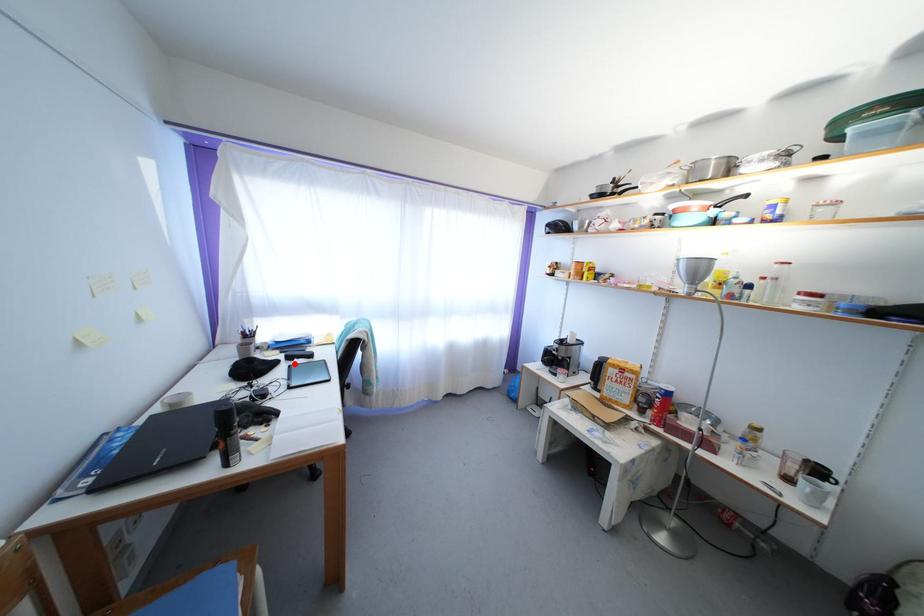
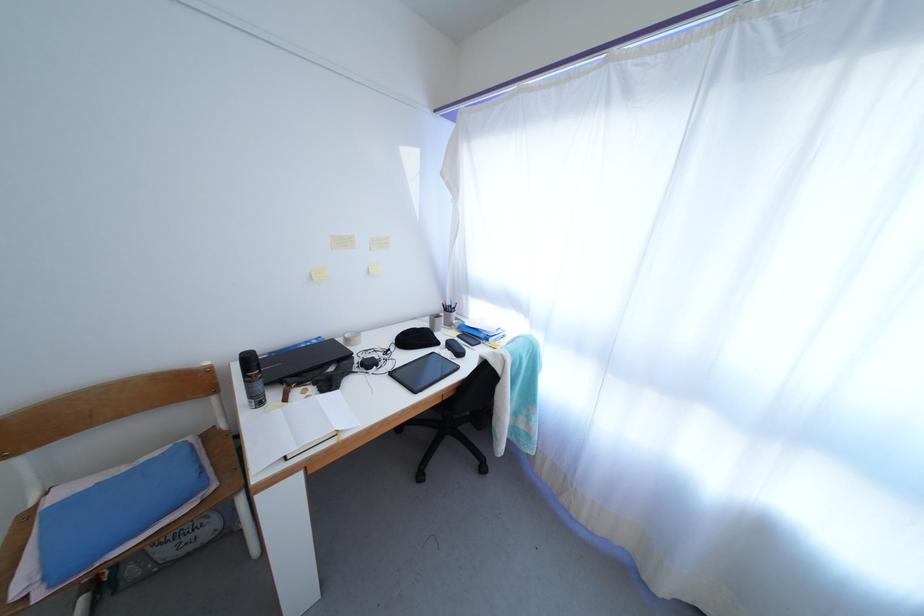
Find the pixel in the second image that matches the highlighted location in the first image.

(456, 351)